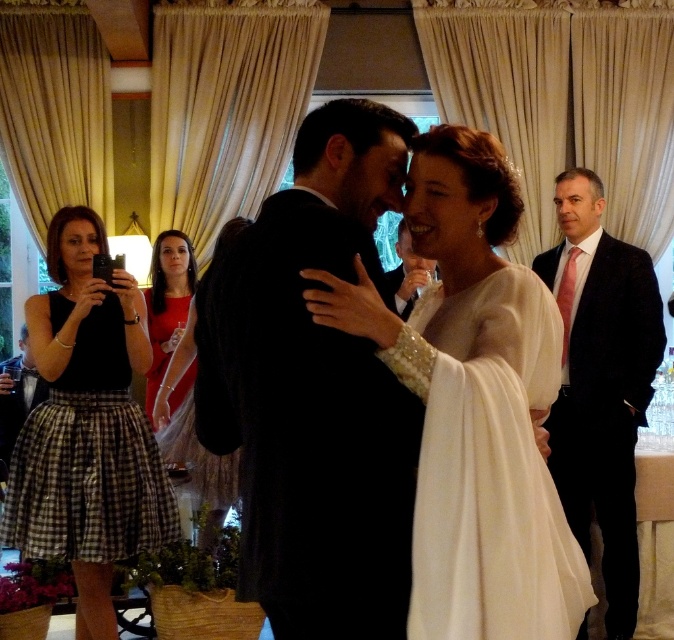
Can you confirm if white satin dress at center is taller than ivory satin dress at center?

Indeed, white satin dress at center has a greater height compared to ivory satin dress at center.

Does white satin dress at center lie in front of ivory satin dress at center?

Yes, it is.

Does point (431, 312) come behind point (545, 285)?

That is True.

Identify the location of white satin dress at center. Image resolution: width=674 pixels, height=640 pixels. 472,403.

Does black satin suit at center appear over white satin dress at center?

Indeed, black satin suit at center is positioned over white satin dress at center.

Can you confirm if black satin suit at center is shorter than white satin dress at center?

Incorrect, black satin suit at center's height does not fall short of white satin dress at center's.

Based on the photo, who is more distant from viewer, (288,364) or (491,227)?

The point (491,227) is more distant.

What are the coordinates of `black satin suit at center` in the screenshot? It's located at (313, 392).

Does black checkered skirt at left have a smaller size compared to matte black suit at center?

No.

Which is in front, point (113, 428) or point (415, 264)?

Positioned in front is point (113, 428).

Find the location of a particular element. The height and width of the screenshot is (640, 674). black checkered skirt at left is located at coordinates tap(88, 428).